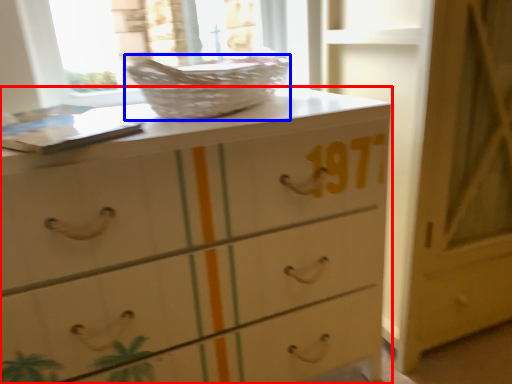
Question: Which point is closer to the camera, chest of drawers (highlighted by a red box) or basket (highlighted by a blue box)?

Choices:
 (A) chest of drawers
 (B) basket

Answer: (A)